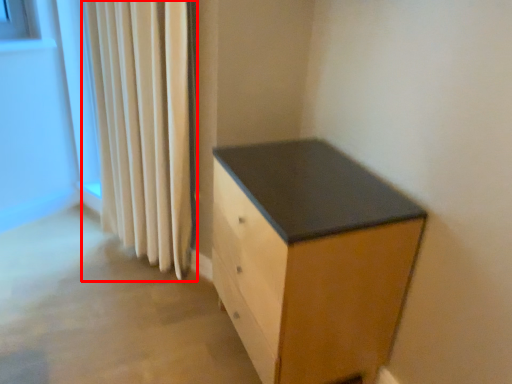
Question: Observing the image, what is the correct spatial positioning of curtain (annotated by the red box) in reference to chest of drawers?

Choices:
 (A) right
 (B) left

Answer: (B)